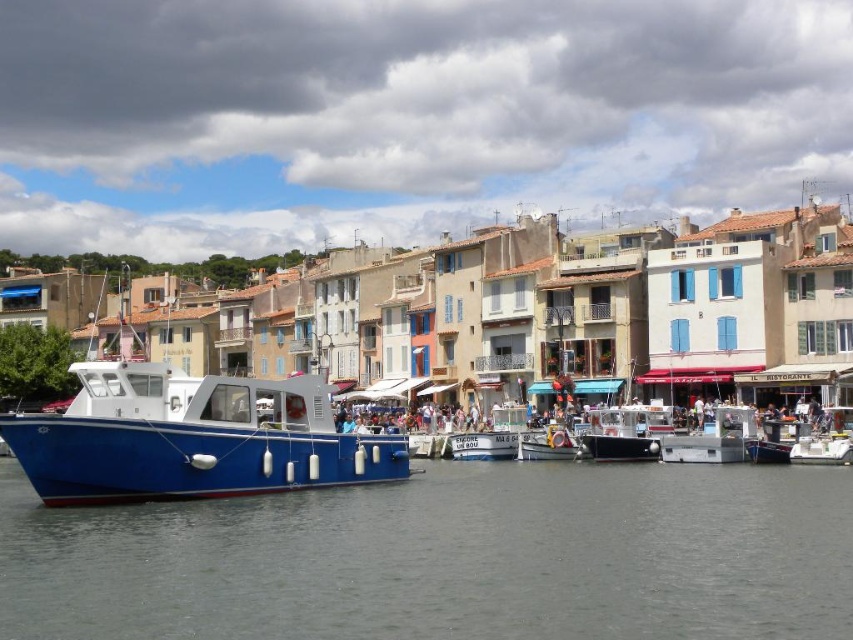
You are standing at the edge of the harbor looking out towards the fishing boat. There are two points marked on the boat deck, one at coordinates point [637,577] and the other at point [606,426]. Which point is closer to you?

Point [637,577] is closer to the camera than point [606,426].

You are a photographer planning to capture the entire harbor scene in one shot. Given that your camera can only focus on objects within a specific area, which object between the gray water at lower center and the black matte boat at center should you prioritize to ensure the most of the scene is in focus?

The gray water at lower center is larger in size than the black matte boat at center, so prioritizing the gray water at lower center would ensure more of the scene is in focus.

You are a tourist standing at the harbor entrance and want to take a photo of the blue matte boat at left. The boat is marked by point (192, 436) in the image. If you move 0.1 units to the right along the x axis, will the boat still be in your camera frame?

The blue matte boat at left is represented by point (192, 436). Moving 0.1 units to the right along the x axis would place the boat at 0.784, 0.226, so yes, the boat will still be in your camera frame.